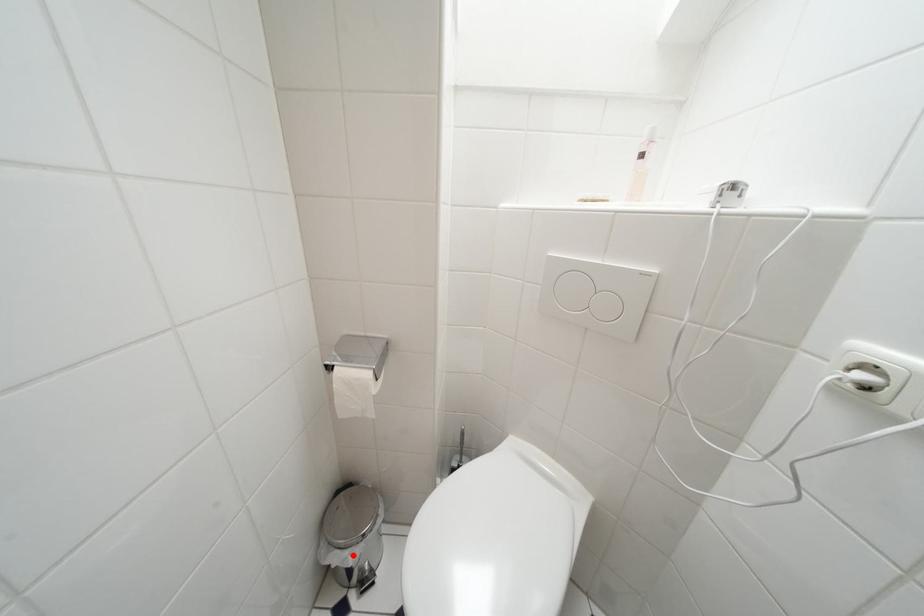
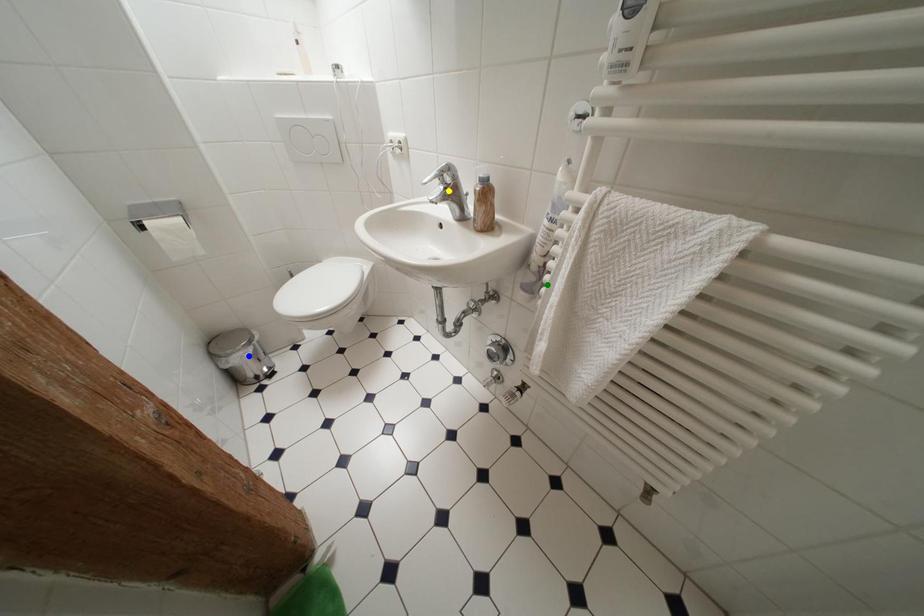
Question: I am providing you with two images of the same scene from different viewpoints. A red point is marked on the first image. You are given multiple points on the second image. Which point in image 2 represents the same 3d spot as the red point in image 1?

Choices:
 (A) green point
 (B) yellow point
 (C) blue point

Answer: (C)